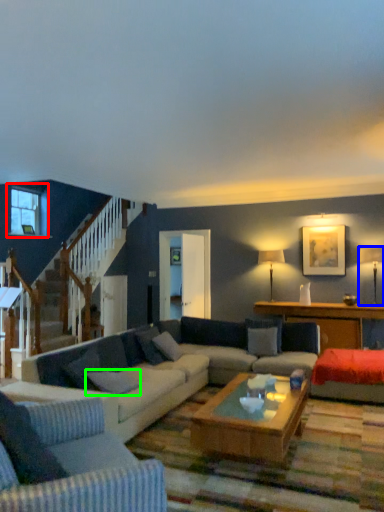
Question: Which object is positioned farthest from window (highlighted by a red box)? Select from lamp (highlighted by a blue box) and pillow (highlighted by a green box).

Choices:
 (A) lamp
 (B) pillow

Answer: (A)